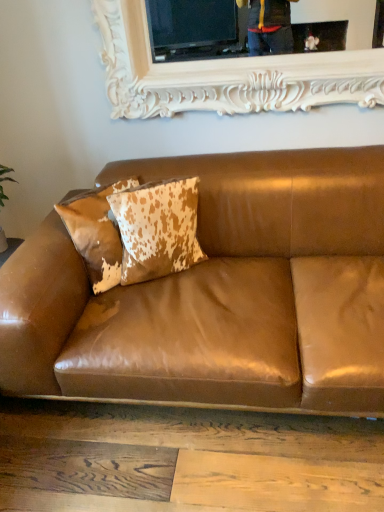
Question: From a real-world perspective, is brown leather couch at center positioned above or below cowhide pillow at upper left, the 1th pillow when ordered from right to left?

Choices:
 (A) below
 (B) above

Answer: (A)

Question: Relative to cowhide pillow at upper left, the 1th pillow when ordered from right to left, is brown leather couch at center in front or behind?

Choices:
 (A) front
 (B) behind

Answer: (A)

Question: Which is farther from the white carved wood picture frame at upper center?

Choices:
 (A) brown leather couch at center
 (B) cowhide pillow at center, which is counted as the first pillow, starting from the left
 (C) cowhide pillow at upper left, the 1th pillow when ordered from right to left

Answer: (A)

Question: Based on their relative distances, which object is farther from the cowhide pillow at center, marked as the 2th pillow in a right-to-left arrangement?

Choices:
 (A) white carved wood picture frame at upper center
 (B) cowhide pillow at upper left, acting as the 2th pillow starting from the left
 (C) brown leather couch at center

Answer: (A)